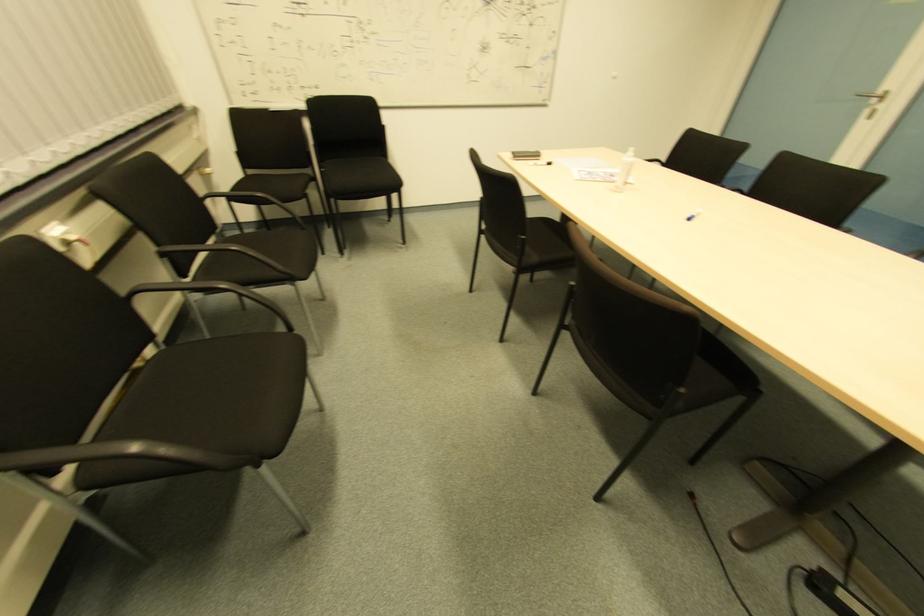
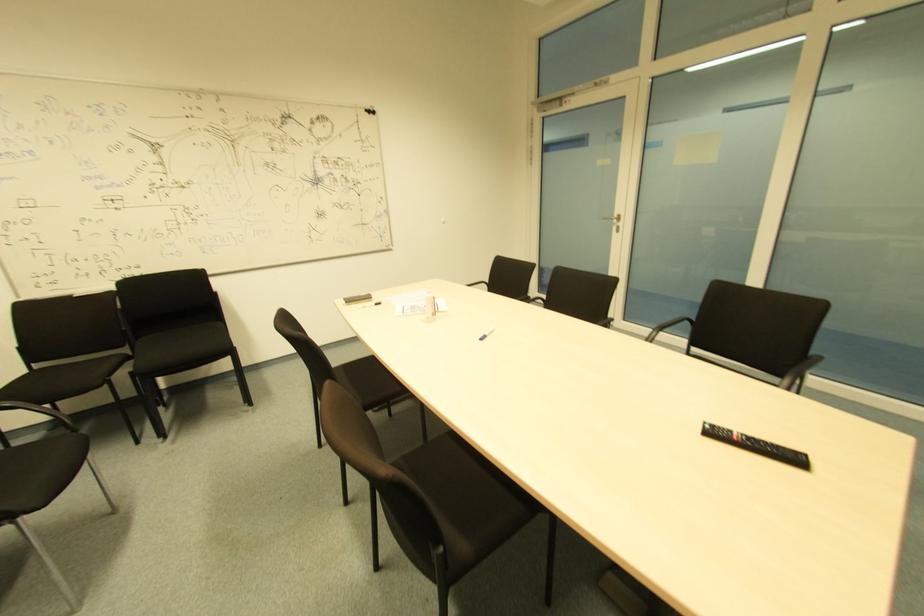
How did the camera likely rotate?

The camera rotated toward right-up.